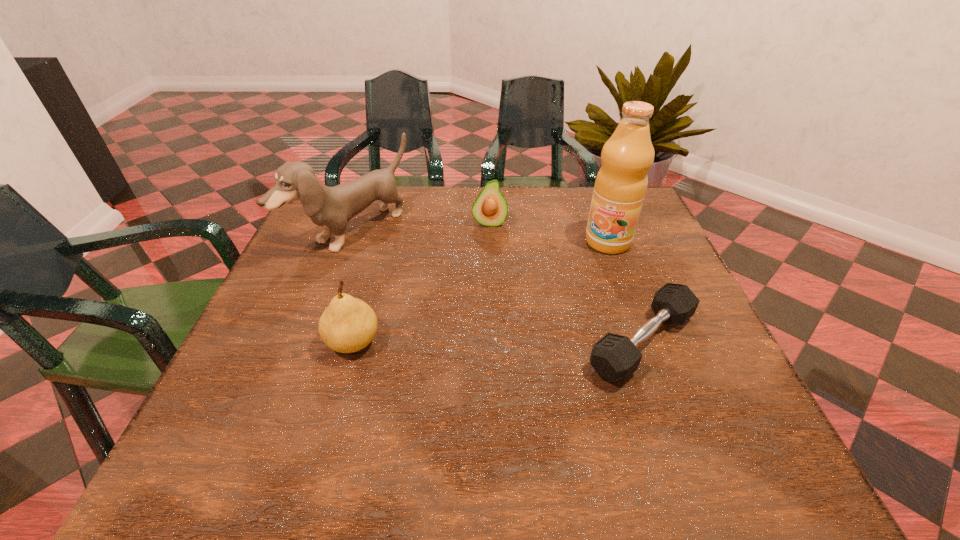
Find the location of `pear`. pear is located at coordinates (348, 324).

You are a GUI agent. You are given a task and a screenshot of the screen. Output one action in this format:
    pyautogui.click(x=<x>, y=<y>)
    Task: Click on the shortest object
    Image resolution: width=960 pixels, height=540 pixels.
    Given the screenshot: What is the action you would take?
    pyautogui.click(x=615, y=357)

Identify the location of the second tallest object. This screenshot has width=960, height=540. (331, 208).

The height and width of the screenshot is (540, 960). I want to click on avocado, so click(x=490, y=208).

Identify the location of fruit juice. (621, 183).

Image resolution: width=960 pixels, height=540 pixels. Identify the location of vacant space located 0.180m on the back of the pear. (374, 267).

In order to click on vacant space located 0.060m on the front of the dumbbell in this screenshot , I will do `click(670, 420)`.

At what (x,y) coordinates should I click in order to perform the action: click on free space located at the face of the puppy. Please return your answer as a coordinate pair (x, y). Looking at the image, I should click on (506, 332).

Identify the location of free location located 0.250m at the face of the puppy. This screenshot has width=960, height=540. (463, 304).

At what (x,y) coordinates should I click in order to perform the action: click on vacant space located 0.340m at the face of the puppy. Please return your answer as a coordinate pair (x, y). Looking at the image, I should click on (494, 325).